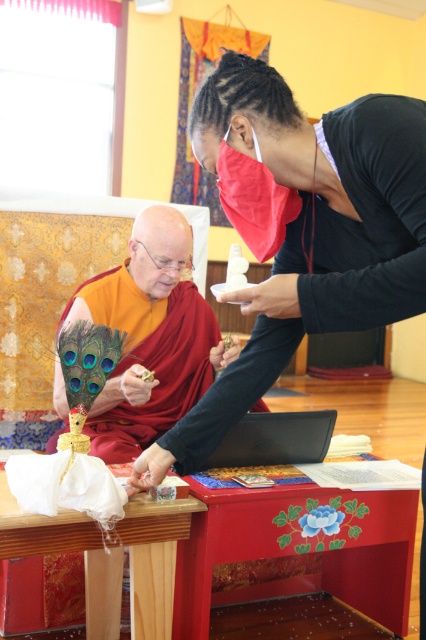
You are standing in the room and see the orange silk robe at center and the shiny gold statue at center. Which object is positioned to the right of the other?

The orange silk robe at center is to the right of the shiny gold statue at center.

You are standing in the room and want to determine which of the two points, point (x=412, y=294) or point (x=192, y=378), is nearer to you. Based on the scene, which point is closer?

Point (x=412, y=294) is closer to the viewer than point (x=192, y=378).

You are standing in the room and looking at the wooden table. There is a red box with floral designs and a point labeled at coordinates (333, 260). What object is located at that point?

The orange silk robe at center is located at point (333, 260).